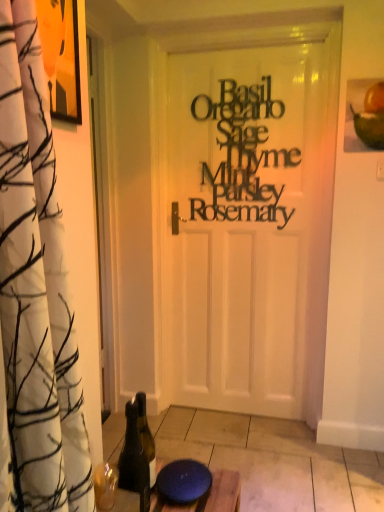
The image size is (384, 512). In order to click on free spot above black paper sign at center (from a real-world perspective) in this screenshot , I will do `click(244, 76)`.